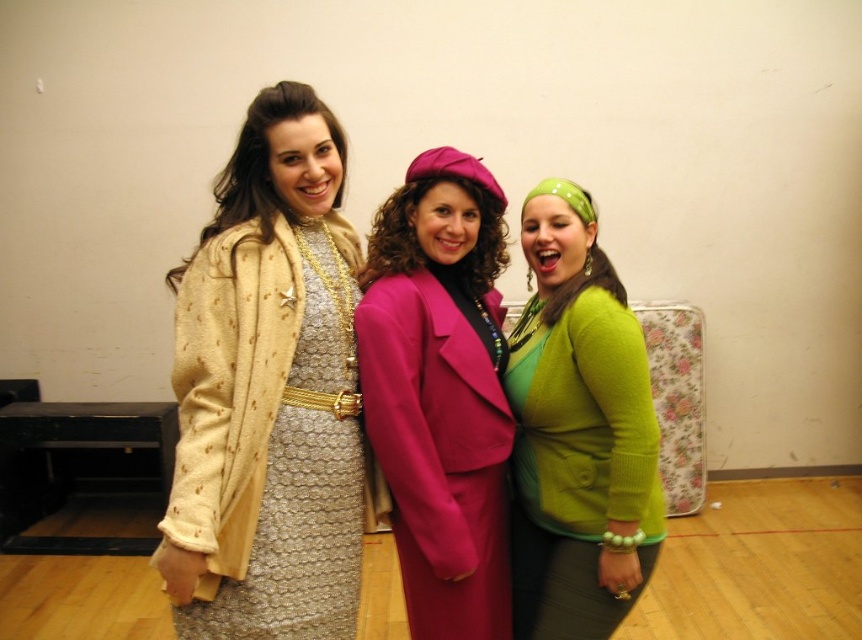
You are a photographer setting up a backdrop for a photoshoot. You need to decide which of the two items, the gold textured dress at center or the green fuzzy sweater at center, will require more space to properly display. Based on the scene description, which one do you think needs more space?

The gold textured dress at center might be wider than green fuzzy sweater at center, so it likely requires more space to display properly.